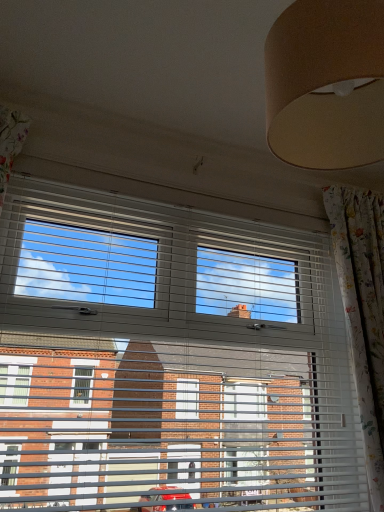
Question: Is floral fabric curtain at right to the left of white plastic blinds at center from the viewer's perspective?

Choices:
 (A) no
 (B) yes

Answer: (A)

Question: Does floral fabric curtain at right lie behind white plastic blinds at center?

Choices:
 (A) yes
 (B) no

Answer: (A)

Question: Does floral fabric curtain at right come in front of white plastic blinds at center?

Choices:
 (A) yes
 (B) no

Answer: (B)

Question: Is floral fabric curtain at right facing towards white plastic blinds at center?

Choices:
 (A) yes
 (B) no

Answer: (B)

Question: Does floral fabric curtain at right have a larger size compared to white plastic blinds at center?

Choices:
 (A) yes
 (B) no

Answer: (B)

Question: Is floral fabric curtain at right wider than white plastic blinds at center?

Choices:
 (A) yes
 (B) no

Answer: (A)

Question: Can you confirm if white plastic blinds at center is bigger than floral fabric curtain at right?

Choices:
 (A) no
 (B) yes

Answer: (B)

Question: Is white plastic blinds at center not near floral fabric curtain at right?

Choices:
 (A) yes
 (B) no

Answer: (B)

Question: From a real-world perspective, does white plastic blinds at center stand above floral fabric curtain at right?

Choices:
 (A) no
 (B) yes

Answer: (A)

Question: Can we say white plastic blinds at center lies outside floral fabric curtain at right?

Choices:
 (A) yes
 (B) no

Answer: (A)

Question: Is white plastic blinds at center facing towards floral fabric curtain at right?

Choices:
 (A) no
 (B) yes

Answer: (B)

Question: Is white plastic blinds at center looking in the opposite direction of floral fabric curtain at right?

Choices:
 (A) yes
 (B) no

Answer: (B)

Question: In terms of width, does white plastic blinds at center look wider or thinner when compared to floral fabric curtain at right?

Choices:
 (A) thin
 (B) wide

Answer: (A)